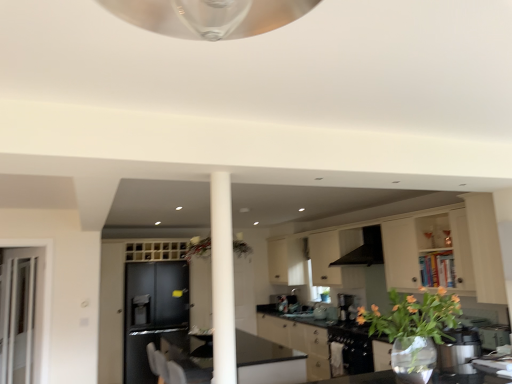
Question: Could matte black cabinet at left, positioned as the third cabinetry in right-to-left order, be considered to be inside clear glass door at left?

Choices:
 (A) no
 (B) yes

Answer: (A)

Question: Is clear glass door at left wider than matte black cabinet at left, positioned as the third cabinetry in right-to-left order?

Choices:
 (A) no
 (B) yes

Answer: (A)

Question: Is the depth of clear glass door at left less than that of matte black cabinet at left, positioned as the third cabinetry in right-to-left order?

Choices:
 (A) no
 (B) yes

Answer: (B)

Question: Is clear glass door at left completely or partially outside of matte black cabinet at left, positioned as the third cabinetry in right-to-left order?

Choices:
 (A) no
 (B) yes

Answer: (B)

Question: Does clear glass door at left have a lesser width compared to matte black cabinet at left, which ranks as the first cabinetry in left-to-right order?

Choices:
 (A) yes
 (B) no

Answer: (A)

Question: Can you confirm if clear glass door at left is bigger than matte black cabinet at left, which ranks as the first cabinetry in left-to-right order?

Choices:
 (A) no
 (B) yes

Answer: (A)

Question: Is the depth of matte black cabinet at left, positioned as the third cabinetry in right-to-left order, greater than that of matte white cabinets at center, positioned as the 3th cabinetry in left-to-right order?

Choices:
 (A) yes
 (B) no

Answer: (A)

Question: From a real-world perspective, is matte black cabinet at left, positioned as the third cabinetry in right-to-left order, physically above matte white cabinets at center, positioned as the 3th cabinetry in left-to-right order?

Choices:
 (A) yes
 (B) no

Answer: (B)

Question: From a real-world perspective, is matte black cabinet at left, positioned as the third cabinetry in right-to-left order, positioned under matte white cabinets at center, acting as the 1th cabinetry starting from the right, based on gravity?

Choices:
 (A) yes
 (B) no

Answer: (A)

Question: Is matte black cabinet at left, which ranks as the first cabinetry in left-to-right order, turned away from matte white cabinets at center, acting as the 1th cabinetry starting from the right?

Choices:
 (A) yes
 (B) no

Answer: (B)

Question: Can you confirm if matte black cabinet at left, positioned as the third cabinetry in right-to-left order, is smaller than matte white cabinets at center, acting as the 1th cabinetry starting from the right?

Choices:
 (A) no
 (B) yes

Answer: (B)

Question: Is matte black cabinet at left, positioned as the third cabinetry in right-to-left order, facing towards matte white cabinets at center, acting as the 1th cabinetry starting from the right?

Choices:
 (A) yes
 (B) no

Answer: (B)

Question: Does translucent glass vase at lower right have a greater height compared to black matte exhaust hood at center?

Choices:
 (A) no
 (B) yes

Answer: (B)